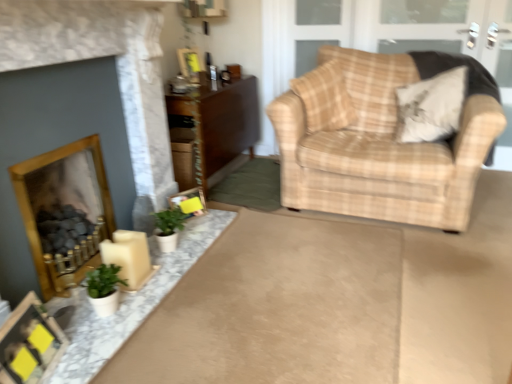
Where is `vacant area located to the right-hand side of white matte candle at lower left`? vacant area located to the right-hand side of white matte candle at lower left is located at coordinates (164, 272).